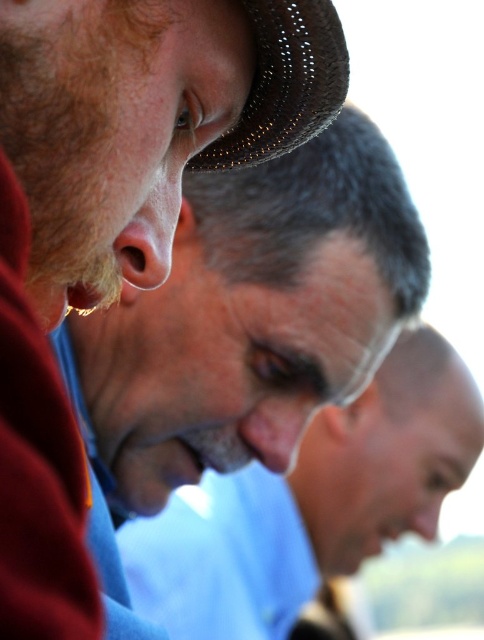
Can you confirm if brown textured hat at upper left is positioned below gray matte face at center?

No.

Is brown textured hat at upper left further to the viewer compared to gray matte face at center?

That is False.

Does point (92, 476) come in front of point (267, 602)?

Yes, it is.

Identify the location of brown textured hat at upper left. The image size is (484, 640). (243, 328).

Does point (316, 484) come closer to viewer compared to point (302, 134)?

No.

What are the coordinates of `gray matte face at center` in the screenshot? It's located at (311, 502).

Does brown textured hat at upper left have a lesser height compared to woven straw hat at upper left?

In fact, brown textured hat at upper left may be taller than woven straw hat at upper left.

Which is below, brown textured hat at upper left or woven straw hat at upper left?

Positioned lower is brown textured hat at upper left.

The width and height of the screenshot is (484, 640). Identify the location of brown textured hat at upper left. (243, 328).

Where is `brown textured hat at upper left`? The height and width of the screenshot is (640, 484). brown textured hat at upper left is located at coordinates (243, 328).